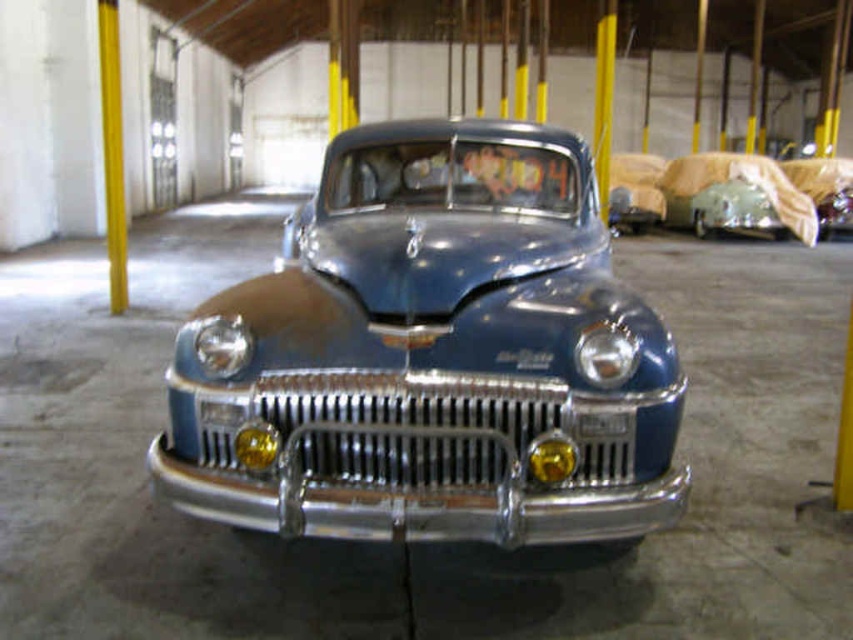
Question: Does metallic blue car at center have a larger size compared to yellow polished metal pole at left?

Choices:
 (A) yes
 (B) no

Answer: (A)

Question: Is the position of metallic blue car at center more distant than that of yellow polished metal pole at left?

Choices:
 (A) no
 (B) yes

Answer: (A)

Question: Does metallic blue car at center appear on the right side of yellow polished metal pole at left?

Choices:
 (A) yes
 (B) no

Answer: (A)

Question: Which object appears closest to the camera in this image?

Choices:
 (A) metallic blue car at center
 (B) yellow polished metal pole at left

Answer: (A)